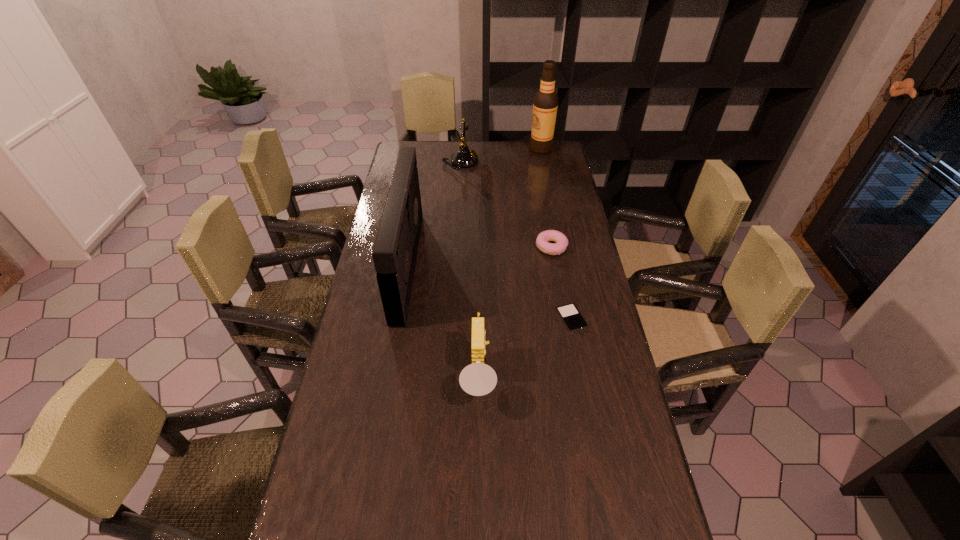
The width and height of the screenshot is (960, 540). I want to click on vacant space situated 0.290m on the front side of the second tallest object, so click(499, 265).

At what (x,y) coordinates should I click in order to perform the action: click on free spot located on the dial of the telephone. Please return your answer as a coordinate pair (x, y). Image resolution: width=960 pixels, height=540 pixels. Looking at the image, I should click on (513, 162).

This screenshot has height=540, width=960. Identify the location of vacant space situated on the front-facing side of the nearest object. (578, 377).

The height and width of the screenshot is (540, 960). I want to click on blank space located 0.150m on the left of the doughnut, so click(494, 247).

Image resolution: width=960 pixels, height=540 pixels. I want to click on free region located 0.220m on the left of the iPod, so click(487, 319).

Locate an element on the screen. The image size is (960, 540). alcohol that is at the far edge is located at coordinates (545, 103).

I want to click on telephone present at the far edge, so click(x=463, y=158).

Identify the location of object located at the left edge. This screenshot has width=960, height=540. (394, 254).

Where is `alcohol at the right edge`? This screenshot has width=960, height=540. alcohol at the right edge is located at coordinates (545, 103).

You are a GUI agent. You are given a task and a screenshot of the screen. Output one action in this format:
    pyautogui.click(x=<x>, y=<y>)
    Task: Click on the doughnut that is at the right edge
    Image resolution: width=960 pixels, height=540 pixels.
    Given the screenshot: What is the action you would take?
    pyautogui.click(x=561, y=242)